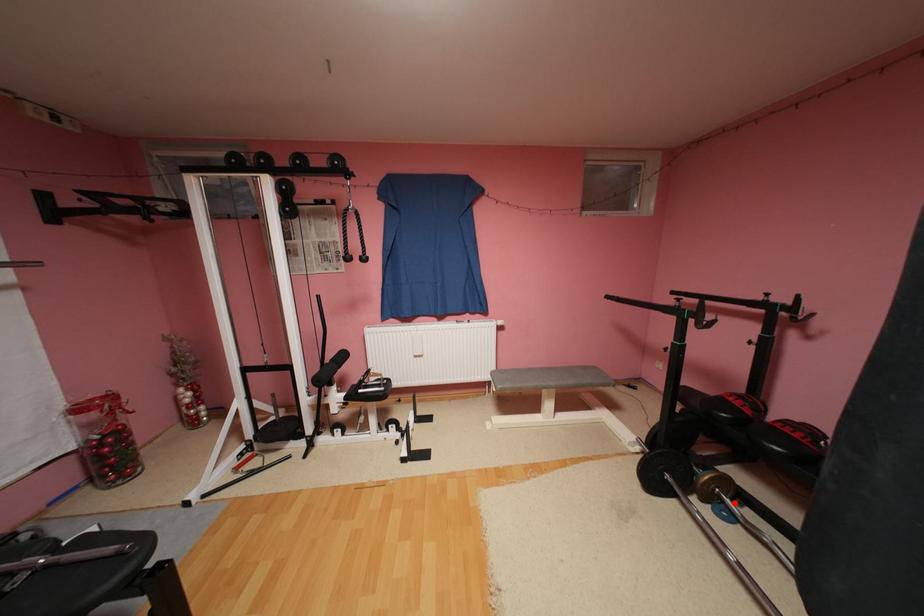
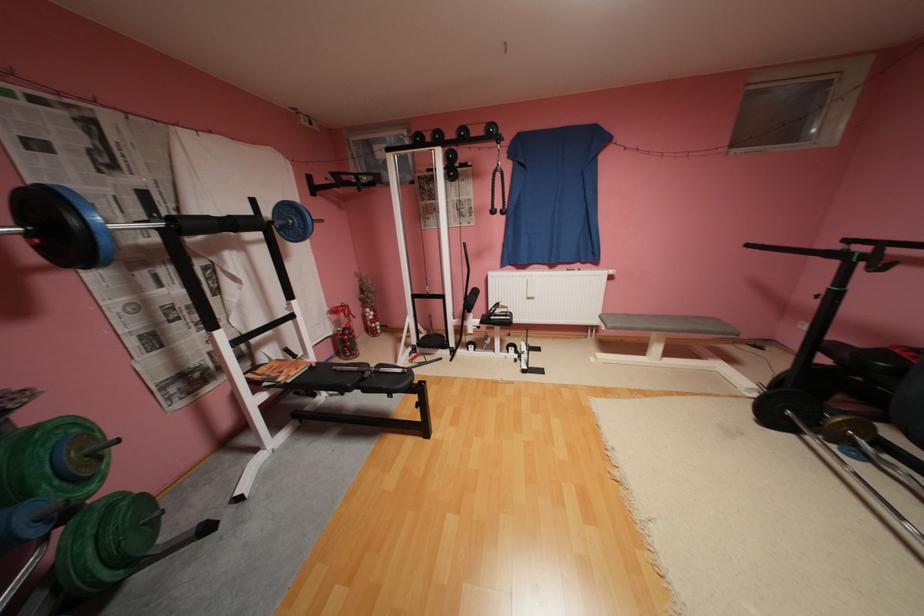
Locate, in the second image, the point that corresponds to the highlighted location in the first image.

(867, 445)